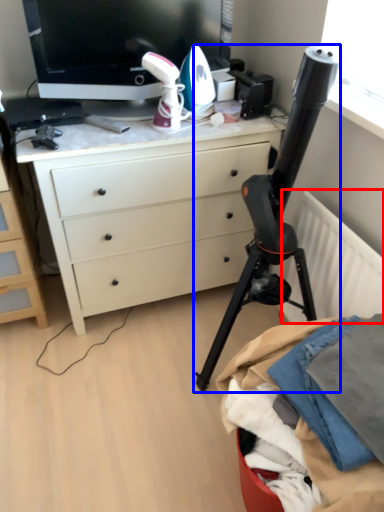
Question: Among these objects, which one is farthest to the camera, radiator (highlighted by a red box) or tripod (highlighted by a blue box)?

Choices:
 (A) radiator
 (B) tripod

Answer: (A)